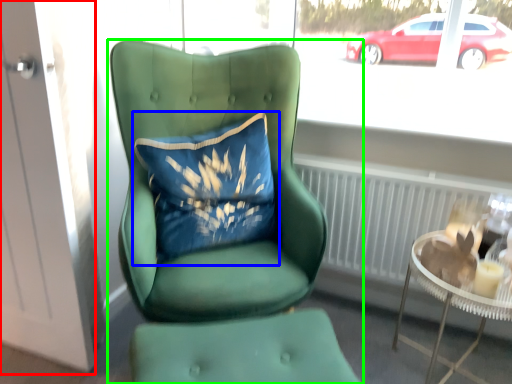
Question: Estimate the real-world distances between objects in this image. Which object is closer to screen door (highlighted by a red box), pillow (highlighted by a blue box) or chair (highlighted by a green box)?

Choices:
 (A) pillow
 (B) chair

Answer: (A)